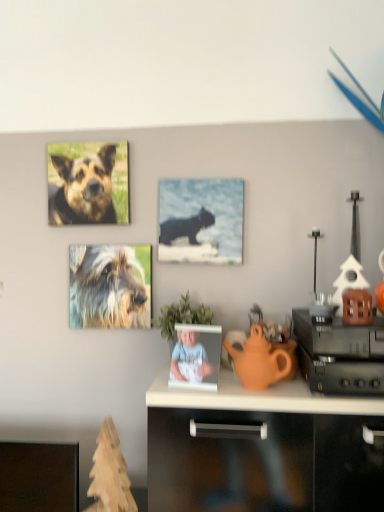
Question: Is black plastic speaker at right situated inside green leafy plant at center or outside?

Choices:
 (A) inside
 (B) outside

Answer: (B)

Question: From a real-world perspective, is black plastic speaker at right above or below green leafy plant at center?

Choices:
 (A) below
 (B) above

Answer: (A)

Question: Which object is the closest to the brown fur dog at upper left, arranged as the 2th dog when ordered from the bottom?

Choices:
 (A) brown matte house at right
 (B) fuzzy fur dog at center, which is counted as the 1th dog, starting from the bottom
 (C) green leafy plant at center
 (D) orange matte teapot at center
 (E) matte black cat at center

Answer: (B)

Question: Which of these objects is positioned farthest from the matte black cat at center?

Choices:
 (A) brown fur dog at upper left, placed as the first dog when sorted from top to bottom
 (B) smooth plastic photo frame at center
 (C) brown matte house at right
 (D) orange matte teapot at center
 (E) black plastic speaker at right

Answer: (C)